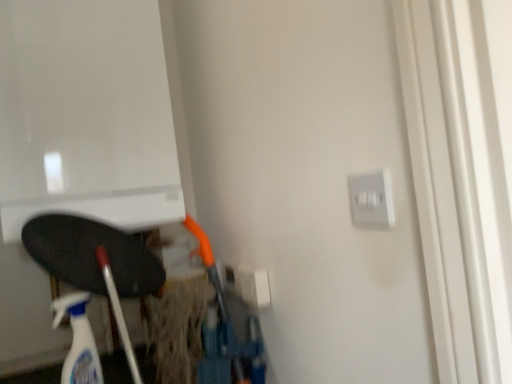
Question: In the image, is satin silver switch at upper right, which appears as the 1th electric outlet when viewed from the top, on the left side or the right side of white plastic electric outlet at center-right, arranged as the first electric outlet when viewed from the left?

Choices:
 (A) left
 (B) right

Answer: (B)

Question: Does point click(354, 221) appear closer or farther from the camera than point click(248, 302)?

Choices:
 (A) farther
 (B) closer

Answer: (B)

Question: Considering the real-world distances, which object is closest to the translucent plastic spray bottle at lower left?

Choices:
 (A) white plastic electric outlet at center-right, arranged as the first electric outlet when viewed from the left
 (B) satin silver switch at upper right, placed as the second electric outlet when sorted from back to front

Answer: (A)

Question: Which of these objects is positioned farthest from the translucent plastic spray bottle at lower left?

Choices:
 (A) white plastic electric outlet at center-right, arranged as the first electric outlet when viewed from the left
 (B) satin silver switch at upper right, the 1th electric outlet when ordered from right to left

Answer: (B)